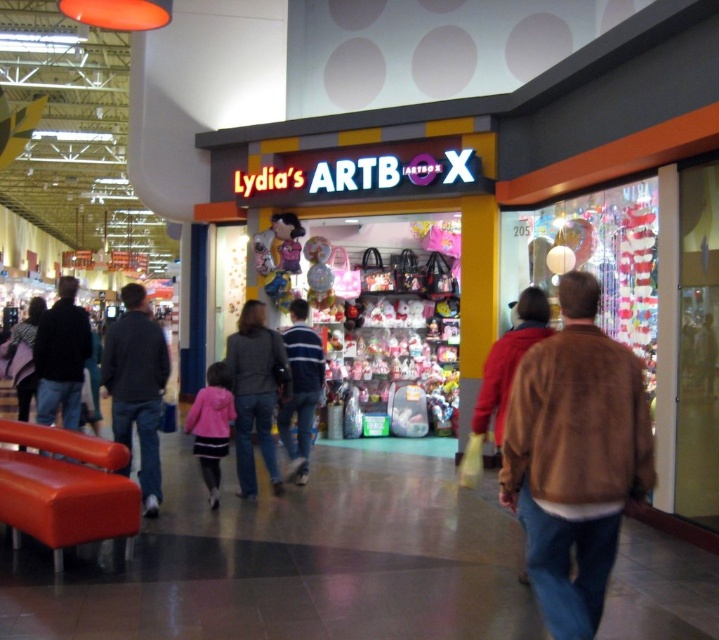
You are standing in front of Lydia ARTBOX store. There is a point at coordinate [129,440]. Is this point closer to you or farther than 6 meters?

The point at coordinate [129,440] is 6.10 meters away from the camera, so it is farther than 6 meters.

You are a customer standing in front of the store entrance. You want to pick up the brown suede jacket at lower right and the striped sweater at center. Which item should you reach for first, and why?

You should reach for the brown suede jacket at lower right first because it is closer to you than the striped sweater at center.